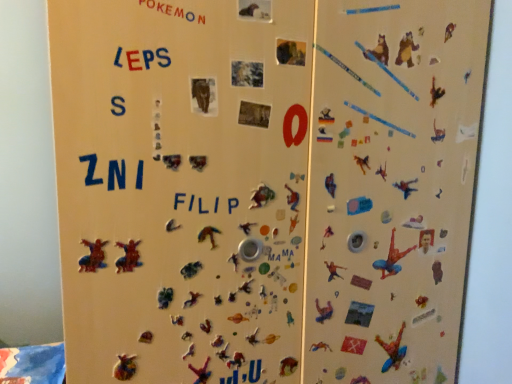
The width and height of the screenshot is (512, 384). Find the location of `multicolored paper magnets at center`. multicolored paper magnets at center is located at coordinates (181, 187).

This screenshot has width=512, height=384. What do you see at coordinates (181, 187) in the screenshot? I see `multicolored paper magnets at center` at bounding box center [181, 187].

What is the approximate width of multicolored paper magnets at center?

multicolored paper magnets at center is 63.34 centimeters in width.

At what (x,y) coordinates should I click in order to perform the action: click on multicolored paper magnets at center. Please return your answer as a coordinate pair (x, y). Looking at the image, I should click on (181, 187).